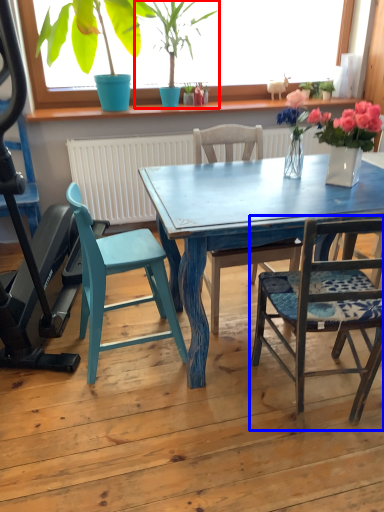
Question: Among these objects, which one is nearest to the camera, houseplant (highlighted by a red box) or chair (highlighted by a blue box)?

Choices:
 (A) houseplant
 (B) chair

Answer: (B)